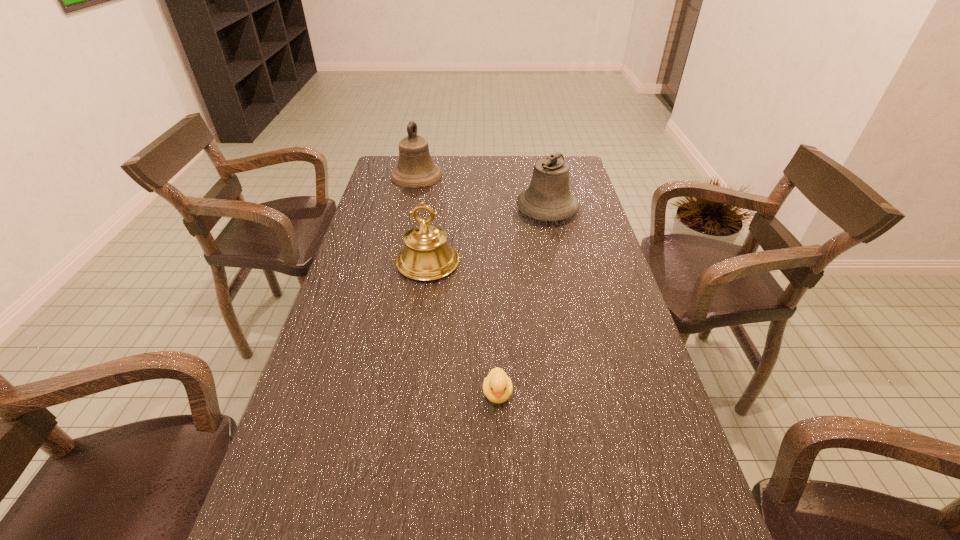
The height and width of the screenshot is (540, 960). Find the location of `free space between the nearest bell and the shortest object`. free space between the nearest bell and the shortest object is located at coordinates (463, 328).

Locate an element on the screen. Image resolution: width=960 pixels, height=540 pixels. free area in between the rightmost bell and the shortest object is located at coordinates (522, 301).

The width and height of the screenshot is (960, 540). I want to click on free point between the second object from right to left and the farthest bell, so click(x=457, y=285).

The height and width of the screenshot is (540, 960). What are the coordinates of `free spot between the third farthest object and the rightmost object` in the screenshot? It's located at (488, 237).

Where is `free spot between the third farthest object and the third object from left to right`? free spot between the third farthest object and the third object from left to right is located at coordinates (463, 328).

Find the location of a particular element. vacant space that's between the third object from left to right and the nearest bell is located at coordinates (463, 328).

Locate an element on the screen. the closest object relative to the farthest object is located at coordinates (548, 198).

Image resolution: width=960 pixels, height=540 pixels. In order to click on the second closest object to the farthest bell in this screenshot , I will do `click(427, 256)`.

Point out which bell is positioned as the nearest to the nearest bell. Please provide its 2D coordinates. Your answer should be formatted as a tuple, i.e. [(x, y)], where the tuple contains the x and y coordinates of a point satisfying the conditions above.

[(548, 198)]

Point out which bell is positioned as the second nearest to the nearest bell. Please provide its 2D coordinates. Your answer should be formatted as a tuple, i.e. [(x, y)], where the tuple contains the x and y coordinates of a point satisfying the conditions above.

[(415, 169)]